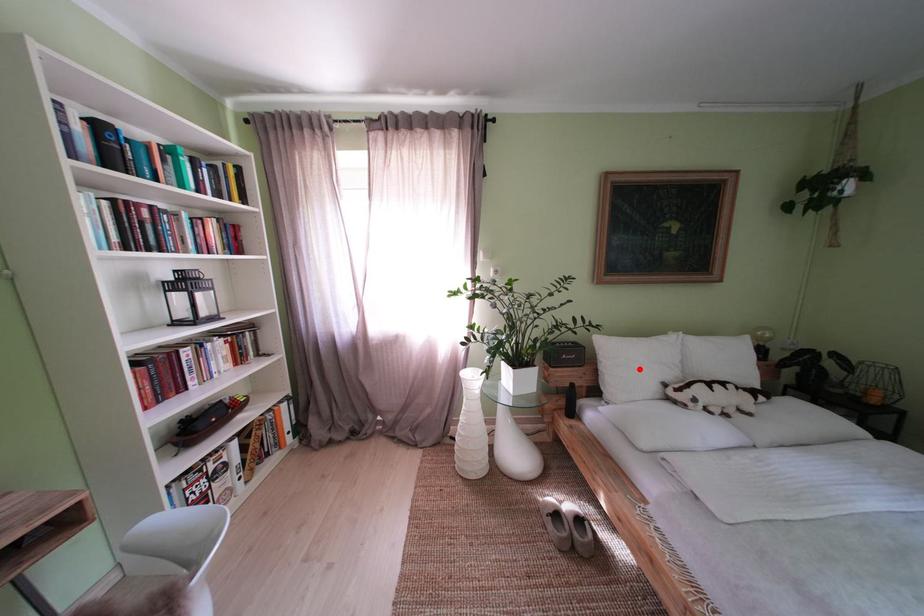
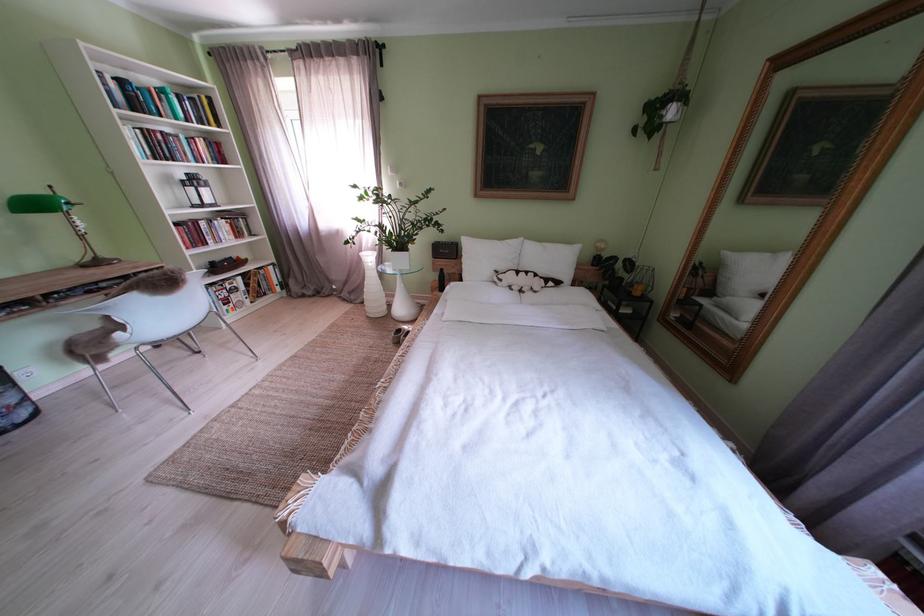
Question: I am providing you with two images of the same scene from different viewpoints. A red point is shown in image1. For the corresponding object point in image2, is it positioned nearer or farther from the camera?

Choices:
 (A) Nearer
 (B) Farther

Answer: (A)